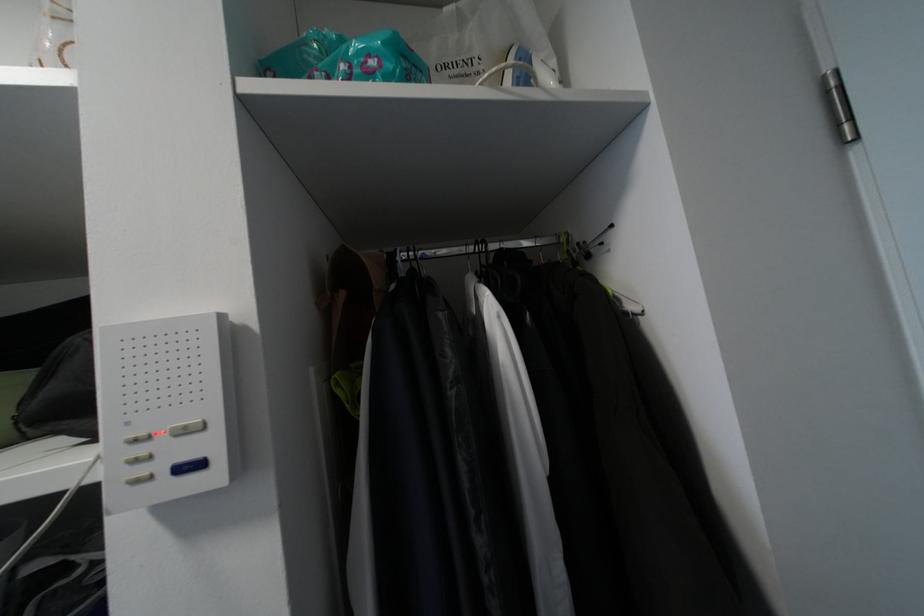
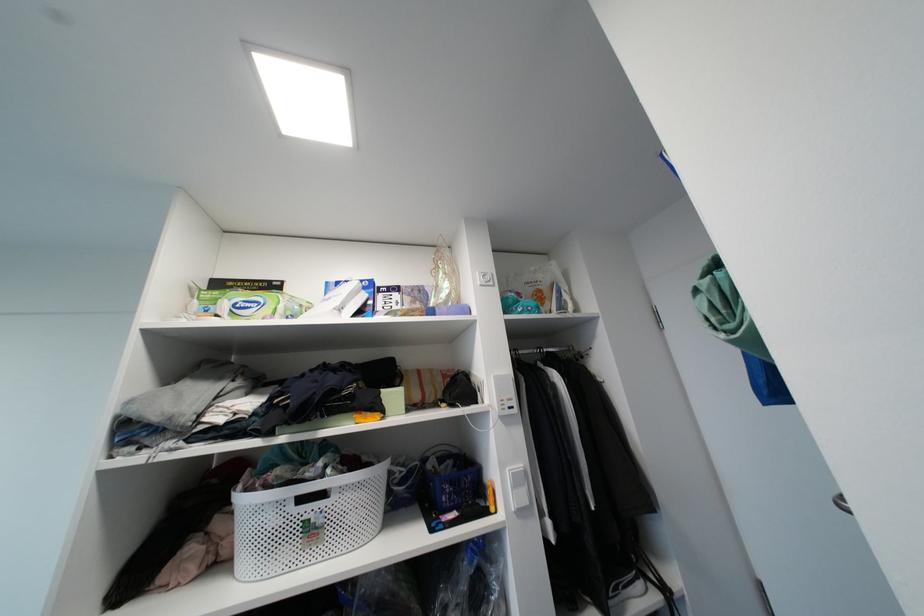
Find the pixel in the second image that matches the point at 497,246 in the first image.

(550, 351)